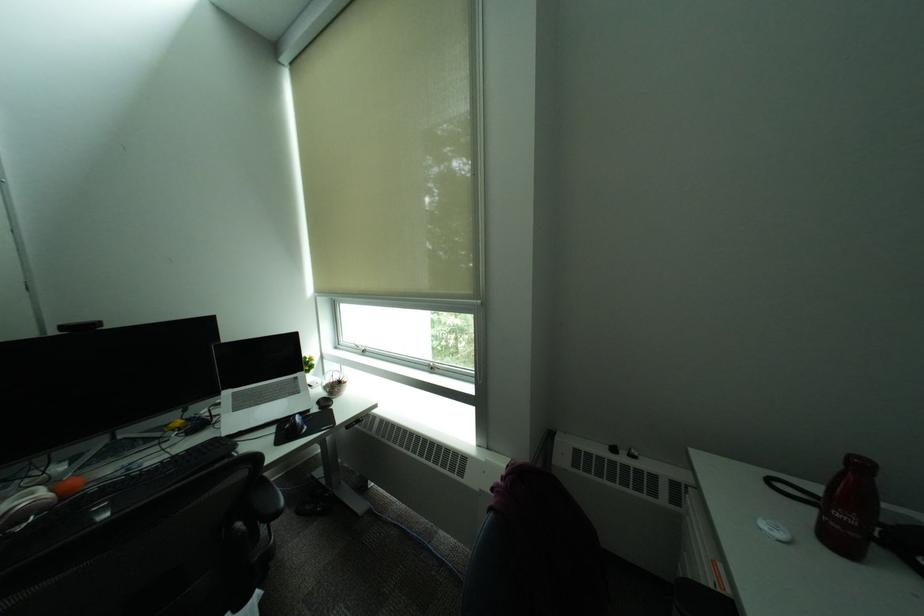
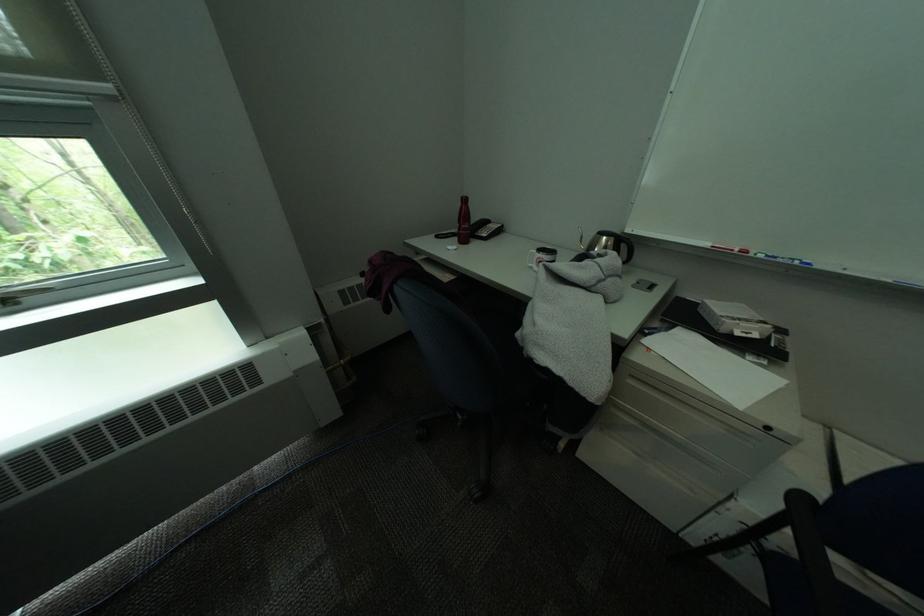
In the second image, find the point that corresponds to [847,516] in the first image.

(475, 228)